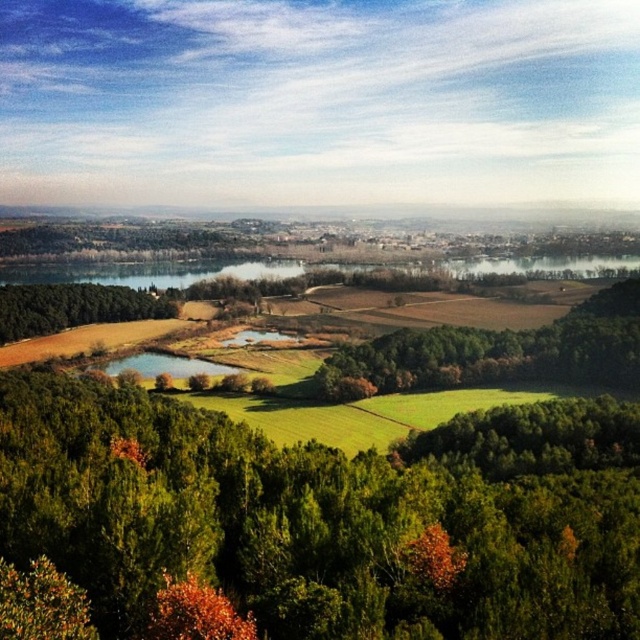
Question: Does green leafy trees at center have a lesser width compared to green leafy tree at lower left?

Choices:
 (A) yes
 (B) no

Answer: (B)

Question: Which of the following is the farthest from the observer?

Choices:
 (A) green leafy trees at center
 (B) green leafy tree at lower left

Answer: (B)

Question: Which point is closer to the camera taking this photo?

Choices:
 (A) (516, 522)
 (B) (35, 284)

Answer: (A)

Question: In this image, where is green leafy trees at center located relative to green leafy tree at lower left?

Choices:
 (A) right
 (B) left

Answer: (A)

Question: Which point is closer to the camera taking this photo?

Choices:
 (A) (40, 292)
 (B) (531, 620)

Answer: (B)

Question: Does green leafy trees at center appear over green leafy tree at lower left?

Choices:
 (A) no
 (B) yes

Answer: (A)